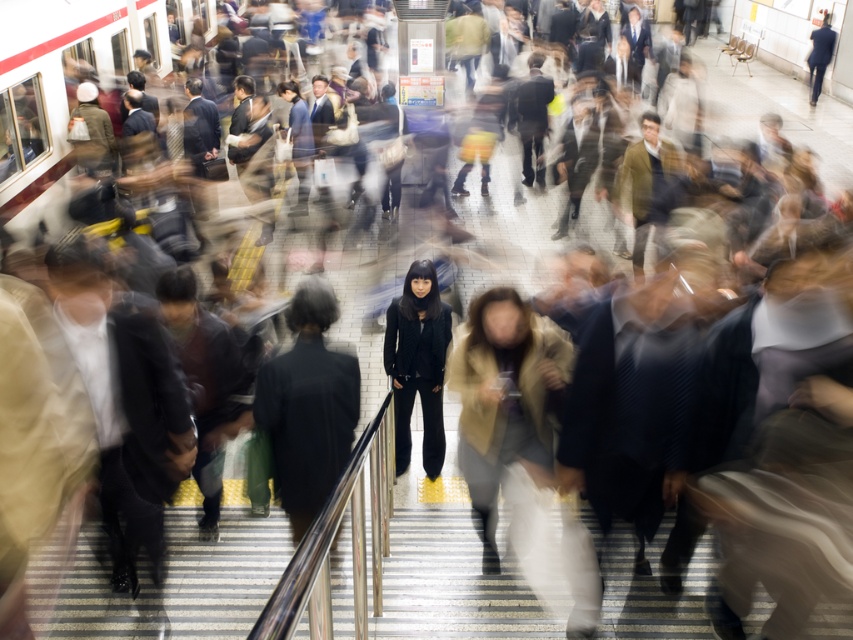
You are a fashion designer analyzing the clothing items in the image. Which clothing item, the dark gray fabric jacket at center or the black matte pants at center, has a smaller size?

The dark gray fabric jacket at center has a smaller size compared to the black matte pants at center.

You are a photographer trying to capture a clear image of the dark gray fabric jacket at center and the black matte pants at center in the busy subway station. Since the jacket and pants are part of the same person, which clothing item would appear more blurred in a long exposure photo if the person starts moving suddenly?

The dark gray fabric jacket at center would appear more blurred because it is wider than the black matte pants at center, making it more susceptible to motion blur during movement.

You are a fashion designer observing a person in the subway station. You notice the dark gray fabric jacket at center and the black matte pants at center. How far apart are these two clothing items on the person?

The dark gray fabric jacket at center and the black matte pants at center are 1.55 meters apart from each other.